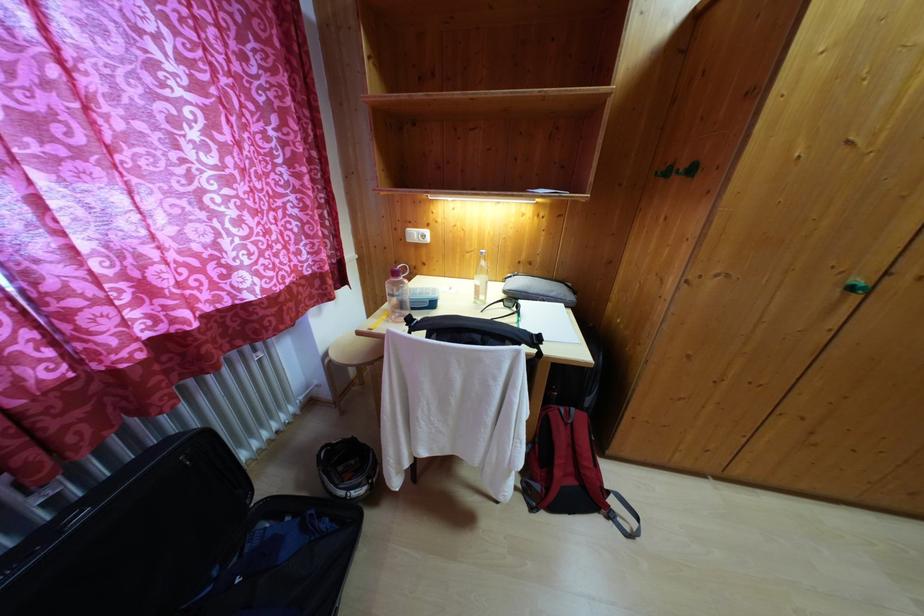
In order to click on grey zipper pouch in this screenshot , I will do `click(184, 544)`.